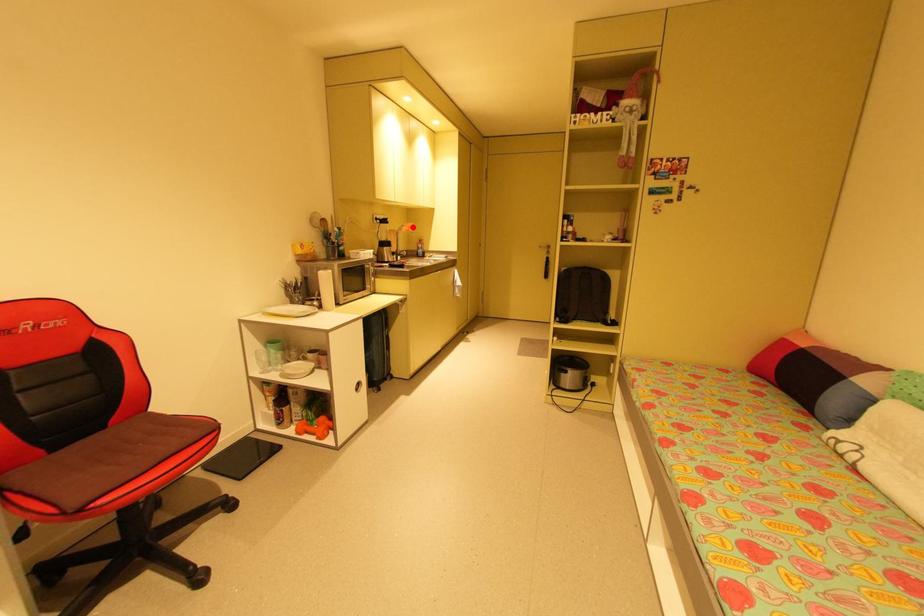
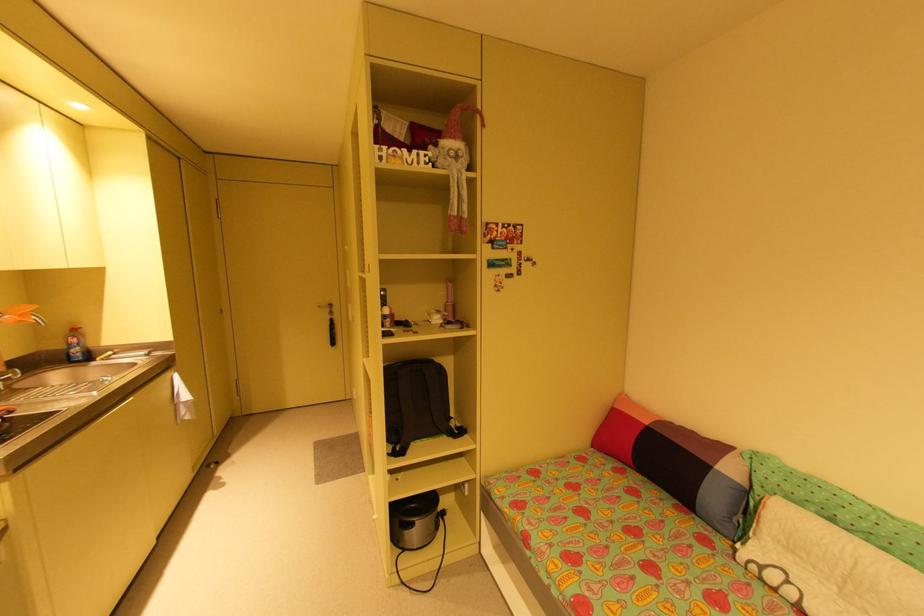
Question: I am providing you with two images of the same scene from different viewpoints. Image1 has a red point marked. In image2, the corresponding 3D location appears at what relative position? Reply with the corresponding letter.

Choices:
 (A) Closer
 (B) Farther

Answer: (B)